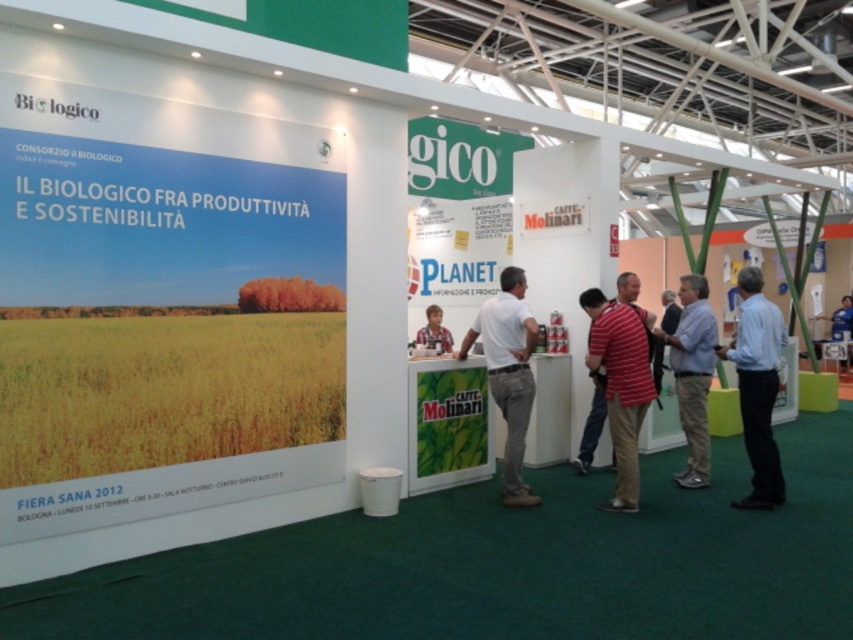
You are at the Biologico booth and need to determine the relative positions of two points marked on the banner. Which point is closer to you, point at position (630,349) or point at position (839,358)?

Point at position (630,349) is closer to the viewer than point at position (839,358).

You are a fashion designer attending the trade fair and see the striped cotton shirt at center and the blue fabric shirt at right. Which shirt is positioned closer to the left side of the booth?

The striped cotton shirt at center is positioned closer to the left side of the booth than the blue fabric shirt at right.